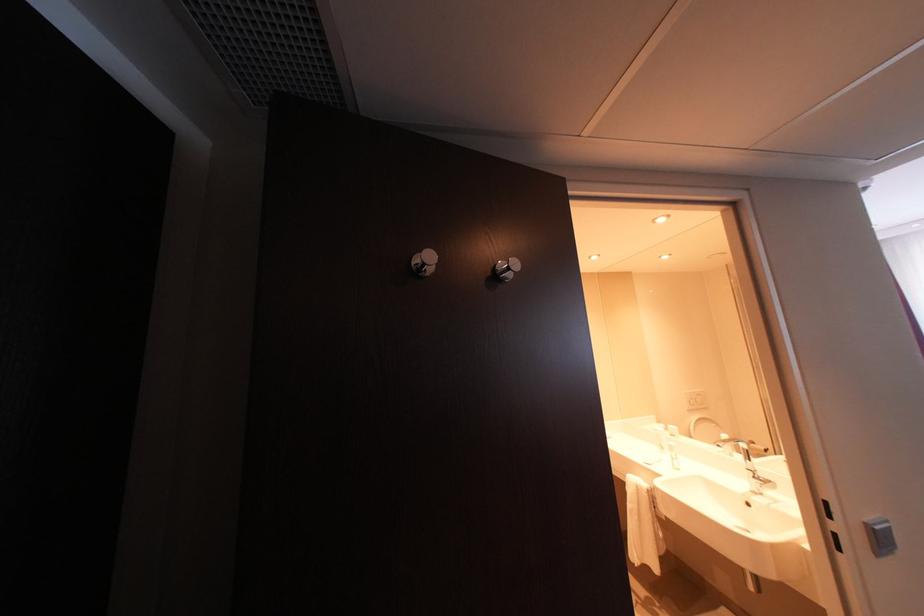
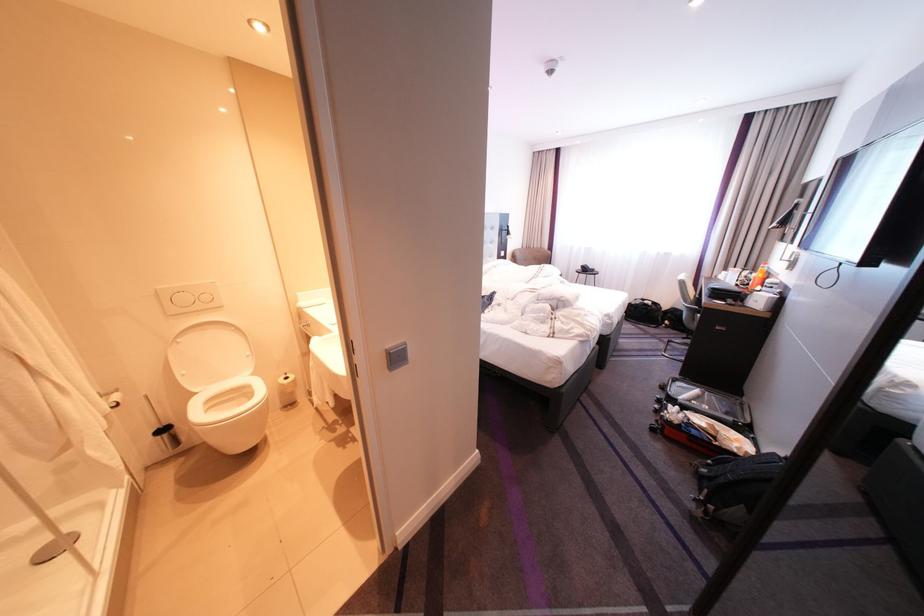
The first image is from the beginning of the video and the second image is from the end. How did the camera likely rotate when shooting the video?

The camera's rotation is toward right-down.